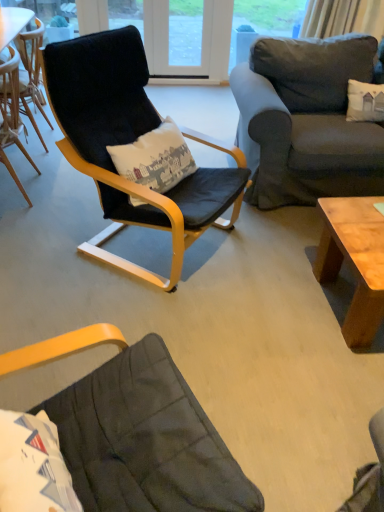
In order to face wooden chair at left, the second chair in the right-to-left sequence, should I rotate leftwards or rightwards?

You should look left and rotate roughly 24.028 degrees.

What is the approximate height of dark gray fabric couch at upper right?

dark gray fabric couch at upper right is 33.11 inches in height.

Locate an element on the screen. light brown wood coffee table at lower right is located at coordinates (354, 261).

Does light brown wood coffee table at lower right have a lesser height compared to velvet black armchair at center, the second chair in the left-to-right sequence?

Yes, light brown wood coffee table at lower right is shorter than velvet black armchair at center, the second chair in the left-to-right sequence.

Considering the positions of objects light brown wood coffee table at lower right and velvet black armchair at center, placed as the first chair when sorted from right to left, in the image provided, who is more to the right, light brown wood coffee table at lower right or velvet black armchair at center, placed as the first chair when sorted from right to left,?

From the viewer's perspective, light brown wood coffee table at lower right appears more on the right side.

From the image's perspective, which is below, light brown wood coffee table at lower right or velvet black armchair at center, the second chair in the left-to-right sequence?

light brown wood coffee table at lower right.

Can you confirm if light brown wood coffee table at lower right is bigger than velvet black armchair at center, the second chair in the left-to-right sequence?

Incorrect, light brown wood coffee table at lower right is not larger than velvet black armchair at center, the second chair in the left-to-right sequence.

From the image's perspective, is dark gray fabric couch at upper right positioned above or below light brown wood coffee table at lower right?

Clearly, from the image's perspective, dark gray fabric couch at upper right is above light brown wood coffee table at lower right.

Which of these two, dark gray fabric couch at upper right or light brown wood coffee table at lower right, is thinner?

light brown wood coffee table at lower right.

Is dark gray fabric couch at upper right oriented away from light brown wood coffee table at lower right?

That's not correct — dark gray fabric couch at upper right is not looking away from light brown wood coffee table at lower right.

Consider the image. Would you say dark gray fabric couch at upper right is outside light brown wood coffee table at lower right?

Yes, dark gray fabric couch at upper right is not within light brown wood coffee table at lower right.

Considering their positions, is wooden chair at left, the second chair in the right-to-left sequence, located in front of or behind velvet black armchair at center, the second chair in the left-to-right sequence?

Clearly, wooden chair at left, the second chair in the right-to-left sequence, is behind velvet black armchair at center, the second chair in the left-to-right sequence.

From the image's perspective, which one is positioned higher, wooden chair at left, which is counted as the first chair, starting from the left, or velvet black armchair at center, placed as the first chair when sorted from right to left?

wooden chair at left, which is counted as the first chair, starting from the left, is shown above in the image.

Is wooden chair at left, the second chair in the right-to-left sequence, next to velvet black armchair at center, the second chair in the left-to-right sequence?

No.

Does point (0, 105) come farther from viewer compared to point (121, 185)?

That is True.

Does wooden chair at left, which is counted as the first chair, starting from the left, have a greater height compared to light brown wood coffee table at lower right?

Yes, wooden chair at left, which is counted as the first chair, starting from the left, is taller than light brown wood coffee table at lower right.

From the image's perspective, between wooden chair at left, which is counted as the first chair, starting from the left, and light brown wood coffee table at lower right, who is located below?

light brown wood coffee table at lower right appears lower in the image.

Which object is positioned more to the right, wooden chair at left, which is counted as the first chair, starting from the left, or light brown wood coffee table at lower right?

Positioned to the right is light brown wood coffee table at lower right.

Is wooden chair at left, which is counted as the first chair, starting from the left, facing towards light brown wood coffee table at lower right?

No, wooden chair at left, which is counted as the first chair, starting from the left, does not turn towards light brown wood coffee table at lower right.

Based on the photo, visually, is light brown wood coffee table at lower right positioned to the left or to the right of wooden chair at left, the second chair in the right-to-left sequence?

light brown wood coffee table at lower right is positioned on wooden chair at left, the second chair in the right-to-left sequence,'s right side.

Can you confirm if light brown wood coffee table at lower right is smaller than wooden chair at left, the second chair in the right-to-left sequence?

Indeed, light brown wood coffee table at lower right has a smaller size compared to wooden chair at left, the second chair in the right-to-left sequence.

Which object is wider, light brown wood coffee table at lower right or wooden chair at left, the second chair in the right-to-left sequence?

With larger width is light brown wood coffee table at lower right.

You are a GUI agent. You are given a task and a screenshot of the screen. Output one action in this format:
    pyautogui.click(x=<x>, y=<y>)
    Task: Click on the chair that is the 2nd one when counting leftward from the light brown wood coffee table at lower right
    The height and width of the screenshot is (512, 384).
    Given the screenshot: What is the action you would take?
    pyautogui.click(x=12, y=114)

Would you say velvet black armchair at center, placed as the first chair when sorted from right to left, contains wooden chair at left, which is counted as the first chair, starting from the left?

No, wooden chair at left, which is counted as the first chair, starting from the left, is not inside velvet black armchair at center, placed as the first chair when sorted from right to left.

Would you say velvet black armchair at center, the second chair in the left-to-right sequence, is a long distance from wooden chair at left, which is counted as the first chair, starting from the left?

No.

Is velvet black armchair at center, the second chair in the left-to-right sequence, aimed at wooden chair at left, the second chair in the right-to-left sequence?

No, velvet black armchair at center, the second chair in the left-to-right sequence, is not aimed at wooden chair at left, the second chair in the right-to-left sequence.

How many degrees apart are the facing directions of light brown wood coffee table at lower right and dark gray fabric couch at upper right?

0.000106 degrees.

From the picture: Is light brown wood coffee table at lower right facing towards dark gray fabric couch at upper right?

No, light brown wood coffee table at lower right is not turned towards dark gray fabric couch at upper right.

From a real-world perspective, who is located lower, light brown wood coffee table at lower right or dark gray fabric couch at upper right?

From a 3D spatial view, light brown wood coffee table at lower right is below.

Would you consider light brown wood coffee table at lower right to be distant from dark gray fabric couch at upper right?

No, light brown wood coffee table at lower right is not far away from dark gray fabric couch at upper right.

From a real-world perspective, starting from the light brown wood coffee table at lower right, which chair is the 2nd one vertically above it? Please provide its 2D coordinates.

[(130, 142)]

Where is `studio couch behind the light brown wood coffee table at lower right`? The height and width of the screenshot is (512, 384). studio couch behind the light brown wood coffee table at lower right is located at coordinates (306, 121).

Estimate the real-world distances between objects in this image. Which object is closer to velvet black armchair at center, the second chair in the left-to-right sequence, dark gray fabric couch at upper right or wooden chair at left, which is counted as the first chair, starting from the left?

dark gray fabric couch at upper right lies closer to velvet black armchair at center, the second chair in the left-to-right sequence, than the other object.

When comparing their distances from light brown wood coffee table at lower right, does velvet black armchair at center, the second chair in the left-to-right sequence, or dark gray fabric couch at upper right seem further?

Based on the image, velvet black armchair at center, the second chair in the left-to-right sequence, appears to be further to light brown wood coffee table at lower right.

Based on their spatial positions, is wooden chair at left, which is counted as the first chair, starting from the left, or dark gray fabric couch at upper right closer to velvet black armchair at center, the second chair in the left-to-right sequence?

dark gray fabric couch at upper right is positioned closer to the anchor velvet black armchair at center, the second chair in the left-to-right sequence.

Based on the photo, based on their spatial positions, is wooden chair at left, which is counted as the first chair, starting from the left, or dark gray fabric couch at upper right further from light brown wood coffee table at lower right?

Among the two, wooden chair at left, which is counted as the first chair, starting from the left, is located further to light brown wood coffee table at lower right.

Looking at the image, which one is located closer to dark gray fabric couch at upper right, light brown wood coffee table at lower right or wooden chair at left, the second chair in the right-to-left sequence?

light brown wood coffee table at lower right is positioned closer to the anchor dark gray fabric couch at upper right.

Which object lies nearer to the anchor point light brown wood coffee table at lower right, dark gray fabric couch at upper right or wooden chair at left, the second chair in the right-to-left sequence?

dark gray fabric couch at upper right lies closer to light brown wood coffee table at lower right than the other object.

Estimate the real-world distances between objects in this image. Which object is further from dark gray fabric couch at upper right, wooden chair at left, which is counted as the first chair, starting from the left, or light brown wood coffee table at lower right?

wooden chair at left, which is counted as the first chair, starting from the left, is positioned further to the anchor dark gray fabric couch at upper right.

When comparing their distances from velvet black armchair at center, the second chair in the left-to-right sequence, does light brown wood coffee table at lower right or dark gray fabric couch at upper right seem further?

Among the two, light brown wood coffee table at lower right is located further to velvet black armchair at center, the second chair in the left-to-right sequence.

Locate an element on the screen. The image size is (384, 512). chair situated between wooden chair at left, the second chair in the right-to-left sequence, and dark gray fabric couch at upper right from left to right is located at coordinates (130, 142).

Where is `coffee table between velvet black armchair at center, the second chair in the left-to-right sequence, and dark gray fabric couch at upper right from left to right`? This screenshot has width=384, height=512. coffee table between velvet black armchair at center, the second chair in the left-to-right sequence, and dark gray fabric couch at upper right from left to right is located at coordinates (354, 261).

Where is `coffee table between wooden chair at left, the second chair in the right-to-left sequence, and dark gray fabric couch at upper right`? The height and width of the screenshot is (512, 384). coffee table between wooden chair at left, the second chair in the right-to-left sequence, and dark gray fabric couch at upper right is located at coordinates (354, 261).

Find the location of a particular element. Image resolution: width=384 pixels, height=512 pixels. chair between wooden chair at left, the second chair in the right-to-left sequence, and light brown wood coffee table at lower right, in the horizontal direction is located at coordinates (130, 142).